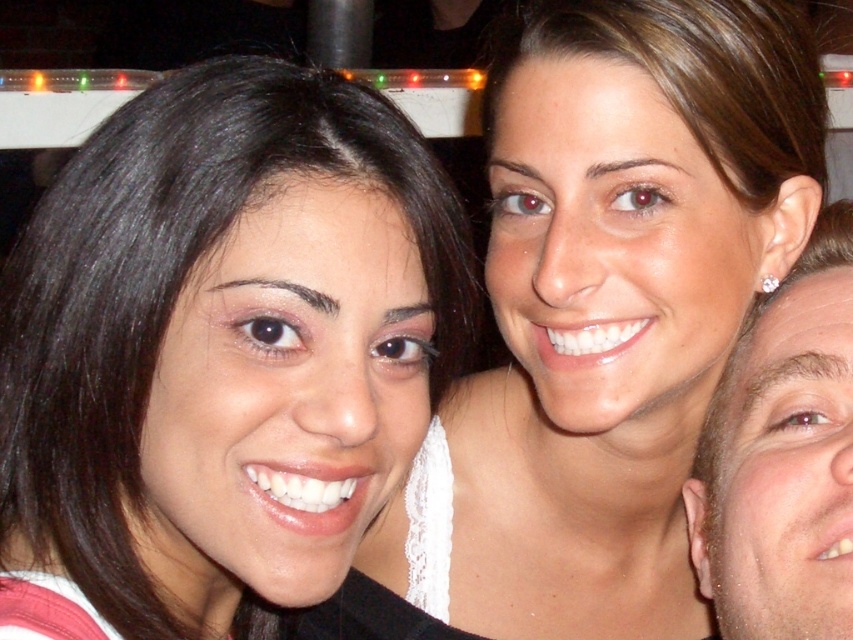
Is matte black hair at left in front of smooth skin face at right?

Yes, matte black hair at left is closer to the viewer.

Does matte black hair at left have a lesser height compared to smooth skin face at right?

Incorrect, matte black hair at left's height does not fall short of smooth skin face at right's.

You are a GUI agent. You are given a task and a screenshot of the screen. Output one action in this format:
    pyautogui.click(x=<x>, y=<y>)
    Task: Click on the matte black hair at left
    The image size is (853, 640).
    Given the screenshot: What is the action you would take?
    pyautogui.click(x=219, y=353)

Does matte white top at center lie behind smooth skin face at right?

Yes, it is behind smooth skin face at right.

What do you see at coordinates (608, 310) in the screenshot?
I see `matte white top at center` at bounding box center [608, 310].

Is point (486, 90) behind point (805, 400)?

Yes.

In order to click on matte white top at center in this screenshot , I will do `click(608, 310)`.

Does point (358, 179) lie behind point (561, 483)?

No, it is not.

Is matte black hair at left below matte white top at center?

Yes.

Identify the location of matte black hair at left. (219, 353).